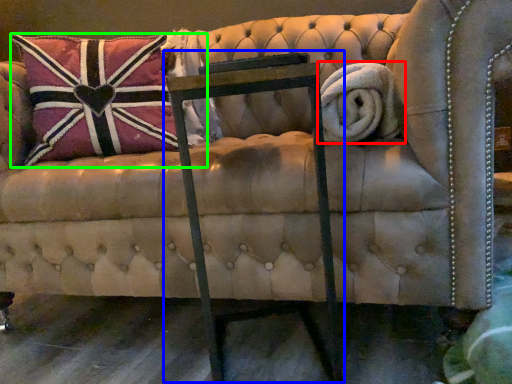
Question: Which is nearer to the bath towel (highlighted by a red box)? rocking chair (highlighted by a blue box) or pillow (highlighted by a green box).

Choices:
 (A) rocking chair
 (B) pillow

Answer: (A)